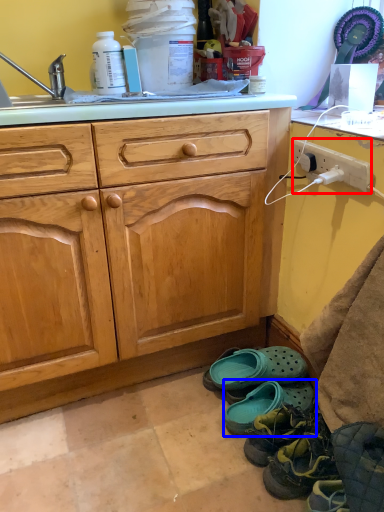
Question: Which object appears closest to the camera in this image, power outlet (highlighted by a red box) or footwear (highlighted by a blue box)?

Choices:
 (A) power outlet
 (B) footwear

Answer: (A)